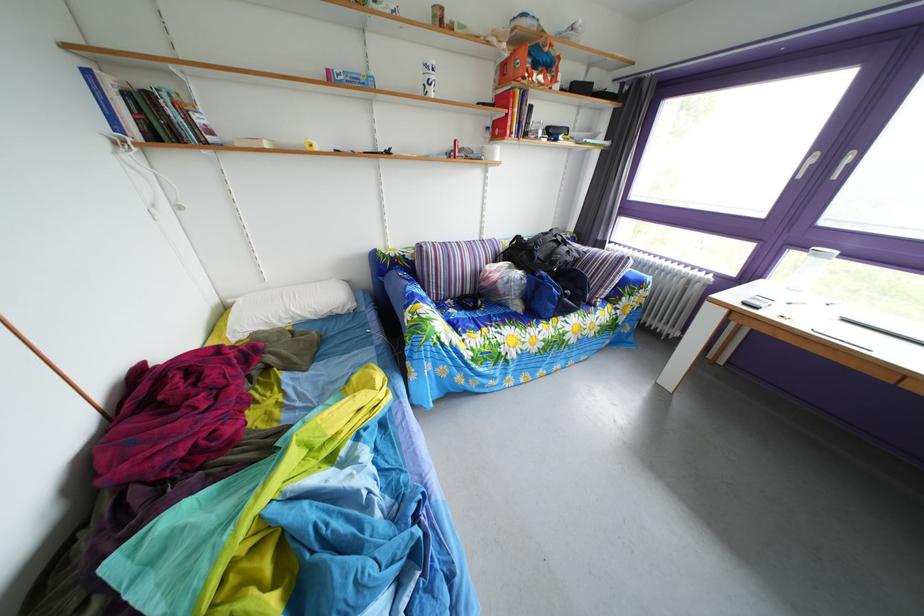
The width and height of the screenshot is (924, 616). Find the location of `black backpack`. black backpack is located at coordinates (541, 252).